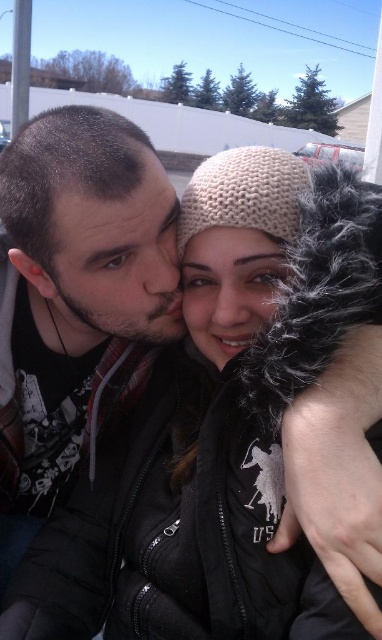
Based on the scene description, where is the dark brown hair at left located in the image?

The dark brown hair at left is located at point (119, 259).

Consider the image. You are a photographer adjusting your camera settings to focus on the matte black jacket at left. The camera has a focus grid that highlights objects at coordinates. What coordinates should you adjust the focus to?

The matte black jacket at left is located at point (77, 289), so adjust the focus to those coordinates.